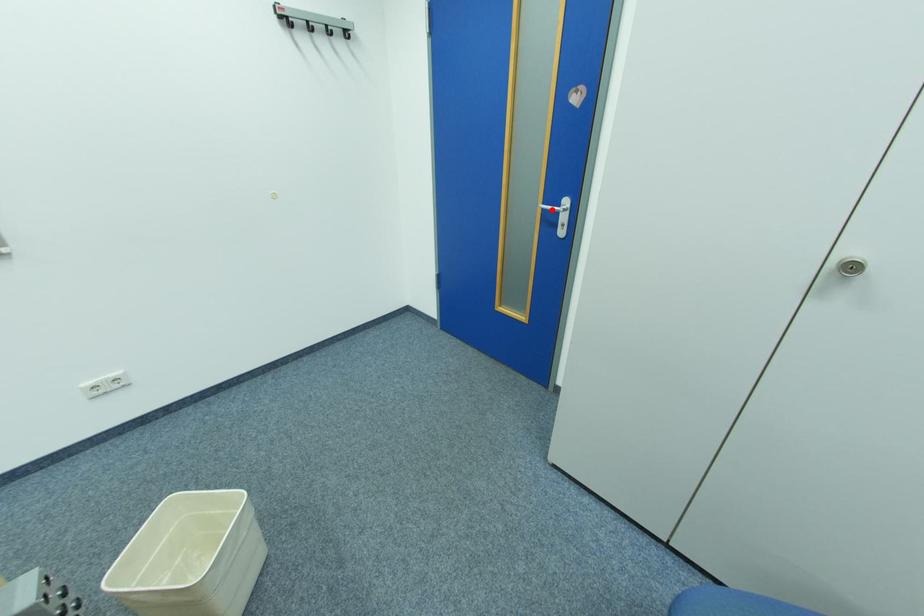
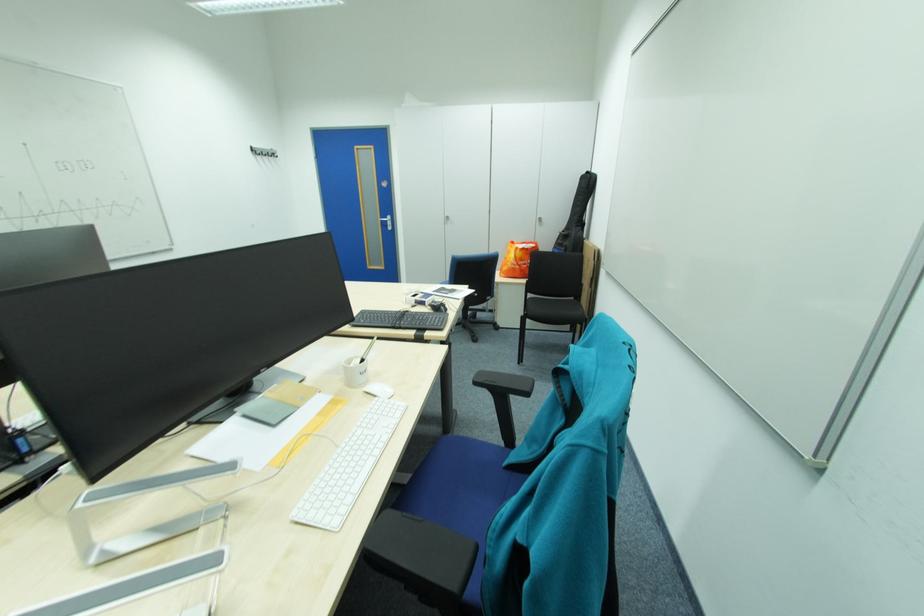
Question: I am providing you with two images of the same scene from different viewpoints. A red point is shown in image1. For the corresponding object point in image2, is it positioned nearer or farther from the camera?

Choices:
 (A) Nearer
 (B) Farther

Answer: (A)